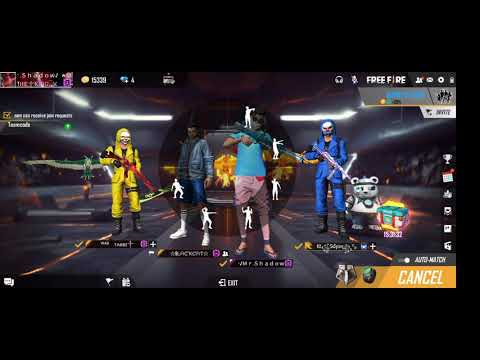
At what (x,y) coordinates should I click in order to perform the action: click on exit button. Please return your answer as a coordinate pair (x, y). The image size is (480, 360). Looking at the image, I should click on (230, 283).